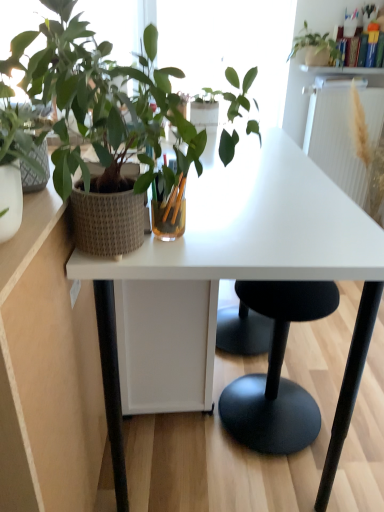
What are the coordinates of `white glossy shelf at upper center` in the screenshot? It's located at (341, 70).

What is the approximate height of textured woven pot at left, the 2th houseplant viewed from the top?

textured woven pot at left, the 2th houseplant viewed from the top, is 21.46 inches tall.

Where is `white matte desk at center`? This screenshot has height=512, width=384. white matte desk at center is located at coordinates (251, 262).

The image size is (384, 512). Identify the location of black matte stool at center. (277, 371).

What is the approximate height of black matte stool at center?

27.59 inches.

Locate an element on the screen. This screenshot has height=512, width=384. white glossy shelf at upper center is located at coordinates (341, 70).

Is textured woven pot at left, placed as the 1th houseplant when sorted from left to right, looking in the opposite direction of white glossy shelf at upper center?

textured woven pot at left, placed as the 1th houseplant when sorted from left to right, is not turned away from white glossy shelf at upper center.

Find the location of a particular element. The width and height of the screenshot is (384, 512). the 2nd houseplant in front of the white glossy shelf at upper center, starting your count from the anchor is located at coordinates (103, 102).

From a real-world perspective, does textured woven pot at left, arranged as the 1th houseplant when viewed from the front, stand above white glossy shelf at upper center?

Yes, from a real-world perspective, textured woven pot at left, arranged as the 1th houseplant when viewed from the front, is over white glossy shelf at upper center

Considering the points (73, 149) and (363, 69), which point is behind, point (73, 149) or point (363, 69)?

Positioned behind is point (363, 69).

Can you confirm if white glossy shelf at upper center is shorter than matte white pot at upper right, which is counted as the second houseplant, starting from the bottom?

Yes, white glossy shelf at upper center is shorter than matte white pot at upper right, which is counted as the second houseplant, starting from the bottom.

From a real-world perspective, between white glossy shelf at upper center and matte white pot at upper right, marked as the 1th houseplant in a back-to-front arrangement, who is vertically higher?

matte white pot at upper right, marked as the 1th houseplant in a back-to-front arrangement.

Is white glossy shelf at upper center not within matte white pot at upper right, marked as the 1th houseplant in a back-to-front arrangement?

white glossy shelf at upper center lies outside matte white pot at upper right, marked as the 1th houseplant in a back-to-front arrangement,'s area.

Is white glossy shelf at upper center not close to matte white pot at upper right, placed as the first houseplant when sorted from right to left?

No.

Is white matte desk at center positioned with its back to textured woven pot at left, arranged as the 1th houseplant when viewed from the front?

That's not correct — white matte desk at center is not looking away from textured woven pot at left, arranged as the 1th houseplant when viewed from the front.

Which object is wider, white matte desk at center or textured woven pot at left, acting as the 2th houseplant starting from the back?

white matte desk at center.

Is matte white pot at upper right, marked as the 1th houseplant in a back-to-front arrangement, smaller than black matte stool at center?

Indeed, matte white pot at upper right, marked as the 1th houseplant in a back-to-front arrangement, has a smaller size compared to black matte stool at center.

Who is shorter, matte white pot at upper right, marked as the 1th houseplant in a back-to-front arrangement, or black matte stool at center?

Standing shorter between the two is matte white pot at upper right, marked as the 1th houseplant in a back-to-front arrangement.

Identify the location of houseplant located behind the black matte stool at center. The image size is (384, 512). (316, 47).

Are textured woven pot at left, the 1th houseplant when ordered from bottom to top, and white matte desk at center making contact?

textured woven pot at left, the 1th houseplant when ordered from bottom to top, is not next to white matte desk at center, and they're not touching.

Is textured woven pot at left, placed as the 1th houseplant when sorted from left to right, bigger or smaller than white matte desk at center?

Considering their sizes, textured woven pot at left, placed as the 1th houseplant when sorted from left to right, takes up less space than white matte desk at center.

Considering the relative sizes of textured woven pot at left, the 1th houseplant when ordered from bottom to top, and white matte desk at center in the image provided, is textured woven pot at left, the 1th houseplant when ordered from bottom to top, thinner than white matte desk at center?

Yes.

How distant is textured woven pot at left, arranged as the 1th houseplant when viewed from the front, from white matte desk at center?

textured woven pot at left, arranged as the 1th houseplant when viewed from the front, is 13.62 inches from white matte desk at center.

Between textured woven pot at left, placed as the 1th houseplant when sorted from left to right, and white textured radiator at upper right, which one appears on the right side from the viewer's perspective?

Positioned to the right is white textured radiator at upper right.

Would you say white textured radiator at upper right is part of textured woven pot at left, the 2th houseplant viewed from the top,'s contents?

Actually, white textured radiator at upper right is outside textured woven pot at left, the 2th houseplant viewed from the top.

Which is closer to the camera, (61, 58) or (363, 79)?

Point (61, 58).

Is textured woven pot at left, the 1th houseplant when ordered from bottom to top, taller or shorter than white textured radiator at upper right?

Considering their sizes, textured woven pot at left, the 1th houseplant when ordered from bottom to top, has less height than white textured radiator at upper right.

Between black matte stool at center and textured woven pot at left, which is the 2th houseplant from right to left, which one is positioned behind?

black matte stool at center is behind.

From the image's perspective, which houseplant is the 1st one above the black matte stool at center? Please provide its 2D coordinates.

[(103, 102)]

Is textured woven pot at left, the 2th houseplant viewed from the top, at the back of black matte stool at center?

No, black matte stool at center is not facing away from textured woven pot at left, the 2th houseplant viewed from the top.

Is black matte stool at center to the right of textured woven pot at left, which is the 2th houseplant from right to left, from the viewer's perspective?

Indeed, black matte stool at center is positioned on the right side of textured woven pot at left, which is the 2th houseplant from right to left.

I want to click on window sill that appears behind the textured woven pot at left, placed as the 1th houseplant when sorted from left to right, so click(341, 70).

This screenshot has width=384, height=512. I want to click on the 2nd houseplant located above the white glossy shelf at upper center (from a real-world perspective), so click(x=316, y=47).

From the picture: From the image, which object appears to be farther from white matte desk at center, white textured radiator at upper right or matte white pot at upper right, which is counted as the second houseplant, starting from the bottom?

matte white pot at upper right, which is counted as the second houseplant, starting from the bottom, lies further to white matte desk at center than the other object.

Estimate the real-world distances between objects in this image. Which object is further from matte white pot at upper right, which is counted as the second houseplant, starting from the bottom, white textured radiator at upper right or textured woven pot at left, which is the 2th houseplant from right to left?

The object further to matte white pot at upper right, which is counted as the second houseplant, starting from the bottom, is textured woven pot at left, which is the 2th houseplant from right to left.

From the image, which object appears to be farther from white matte desk at center, textured woven pot at left, placed as the 1th houseplant when sorted from left to right, or white glossy shelf at upper center?

white glossy shelf at upper center is positioned further to the anchor white matte desk at center.

When comparing their distances from white matte desk at center, does white textured radiator at upper right or textured woven pot at left, acting as the 2th houseplant starting from the back, seem further?

white textured radiator at upper right.

Considering their positions, is black matte stool at center positioned closer to textured woven pot at left, arranged as the 1th houseplant when viewed from the front, than white glossy shelf at upper center?

Based on the image, black matte stool at center appears to be nearer to textured woven pot at left, arranged as the 1th houseplant when viewed from the front.

Based on their spatial positions, is white textured radiator at upper right or white matte desk at center further from white glossy shelf at upper center?

Among the two, white matte desk at center is located further to white glossy shelf at upper center.

Considering their positions, is black matte stool at center positioned closer to white textured radiator at upper right than white glossy shelf at upper center?

white glossy shelf at upper center.

Based on their spatial positions, is white textured radiator at upper right or black matte stool at center closer to white matte desk at center?

The object closer to white matte desk at center is black matte stool at center.

Find the location of a particular element. The width and height of the screenshot is (384, 512). window sill that lies between matte white pot at upper right, the 1th houseplant positioned from the top, and white textured radiator at upper right from top to bottom is located at coordinates (341, 70).

At what (x,y) coordinates should I click in order to perform the action: click on radiator between white matte desk at center and white glossy shelf at upper center from front to back. Please return your answer as a coordinate pair (x, y). Looking at the image, I should click on (334, 135).

Where is `desk positioned between textured woven pot at left, the 2th houseplant viewed from the top, and black matte stool at center from near to far`? This screenshot has height=512, width=384. desk positioned between textured woven pot at left, the 2th houseplant viewed from the top, and black matte stool at center from near to far is located at coordinates (251, 262).

I want to click on desk between textured woven pot at left, placed as the 1th houseplant when sorted from left to right, and matte white pot at upper right, the second houseplant from the front, along the z-axis, so click(x=251, y=262).